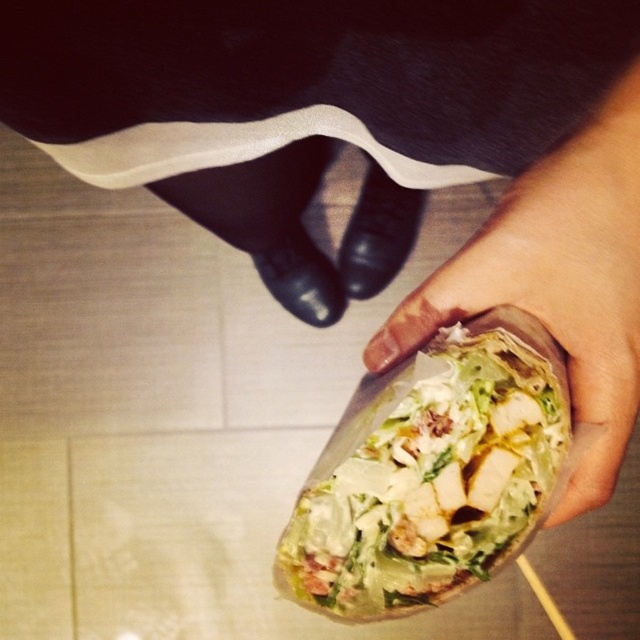
You are trying to reach the point at coordinates point (291, 572) in the image. Your hand is currently 14 inches away from that point. How much farther do you need to move your hand to reach the point?

The distance between point (291, 572) and the viewer is 16.35 inches. Since your hand is currently 14 inches away from the point, you need to move an additional 2.35 inches to reach it.

You are at a food stall and want to grab the green leafy salad at center and the translucent plastic wrap at lower right. Which one is closer to your right hand?

The translucent plastic wrap at lower right is closer to your right hand because it is to the right of the green leafy salad at center.